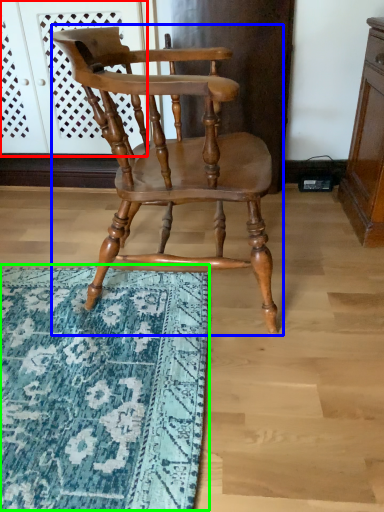
Question: Which object is the farthest from screen door (highlighted by a red box)? Choose among these: chair (highlighted by a blue box) or mat (highlighted by a green box).

Choices:
 (A) chair
 (B) mat

Answer: (B)